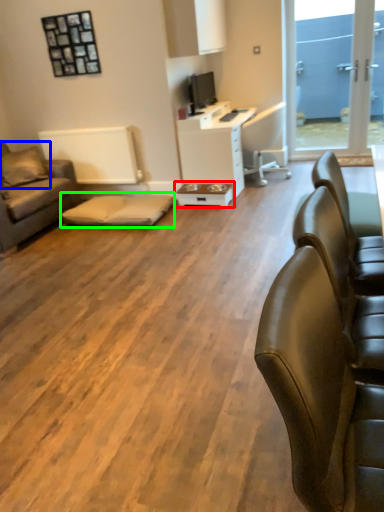
Question: Which object is the closest to the table (highlighted by a red box)? Choose among these: pillow (highlighted by a blue box) or bar stool (highlighted by a green box).

Choices:
 (A) pillow
 (B) bar stool

Answer: (B)